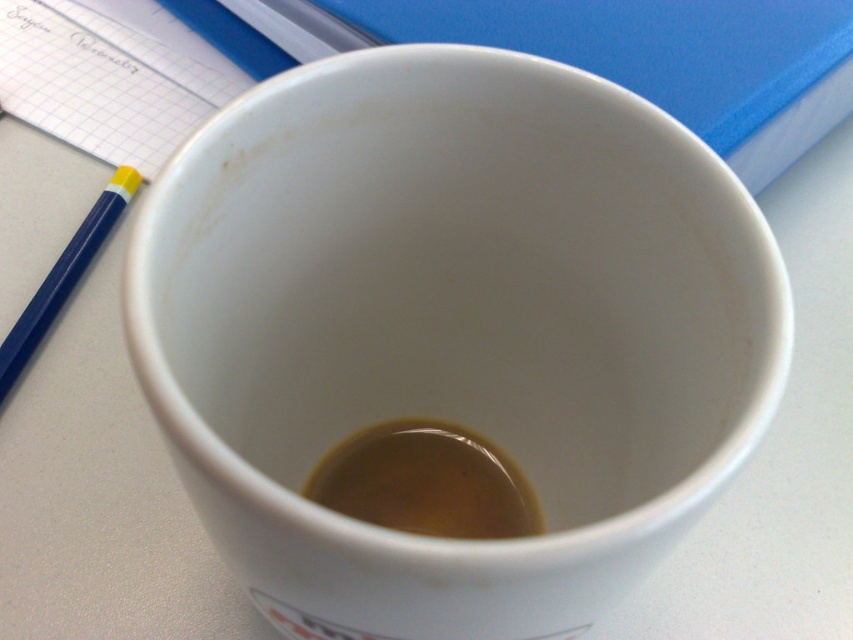
Which of these two, brown matte liquid at center or blue plastic pencil at left, stands taller?

blue plastic pencil at left

Is point (421, 442) behind point (27, 307)?

No.

At what (x,y) coordinates should I click in order to perform the action: click on brown matte liquid at center. Please return your answer as a coordinate pair (x, y). Image resolution: width=853 pixels, height=640 pixels. Looking at the image, I should click on (425, 483).

Who is lower down, white ceramic mug at center or brown matte liquid at center?

brown matte liquid at center is lower down.

Can you confirm if white ceramic mug at center is wider than brown matte liquid at center?

Yes.

Does point (596, 440) come farther from viewer compared to point (416, 532)?

No, it is not.

Where is `white ceramic mug at center`? This screenshot has height=640, width=853. white ceramic mug at center is located at coordinates (451, 330).

Find the location of `white ceramic mug at center`. white ceramic mug at center is located at coordinates (451, 330).

Consider the image. Who is lower down, white ceramic mug at center or blue plastic pencil at left?

white ceramic mug at center is lower down.

The image size is (853, 640). Find the location of `white ceramic mug at center`. white ceramic mug at center is located at coordinates (451, 330).

Identify the location of white ceramic mug at center. This screenshot has height=640, width=853. (451, 330).